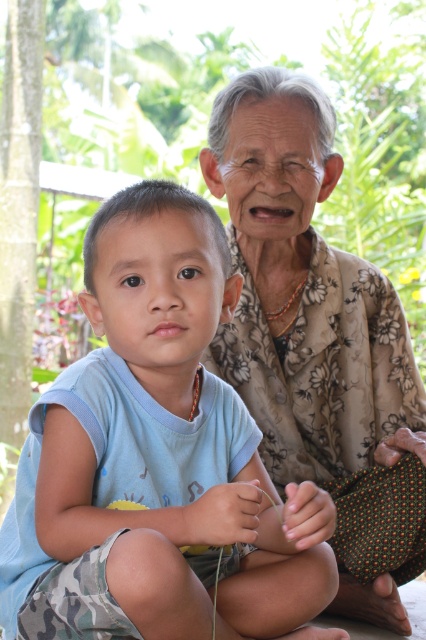
What is the exact position of the blue cotton shirt at center in the image?

The blue cotton shirt at center is located at point (157,460).